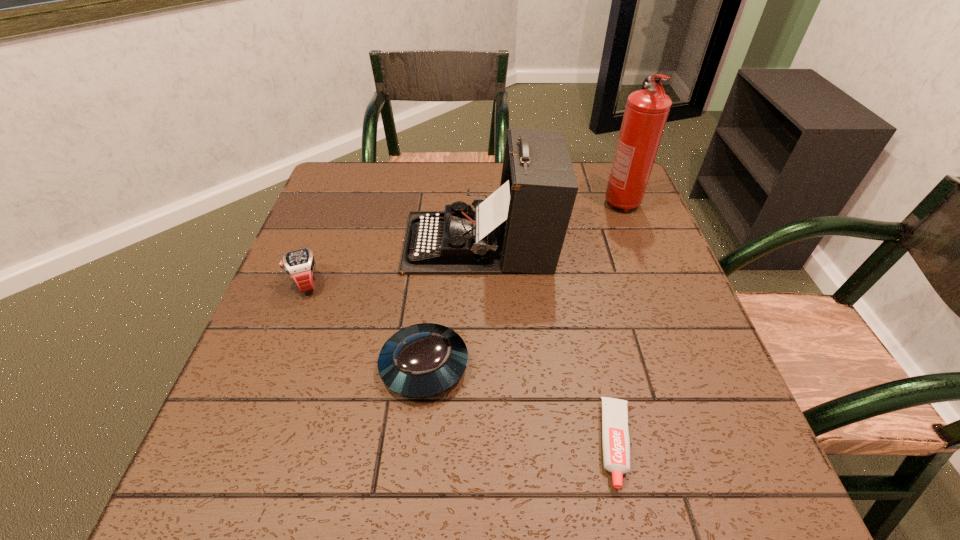
You are a GUI agent. You are given a task and a screenshot of the screen. Output one action in this format:
    pyautogui.click(x=<x>, y=<y>)
    Task: Click on the vacant space located 0.240m inside the open case of the second tallest object
    The height and width of the screenshot is (540, 960).
    Given the screenshot: What is the action you would take?
    pyautogui.click(x=308, y=242)

What are the coordinates of `free point located 0.120m inside the open case of the second tallest object` in the screenshot? It's located at 356,242.

You are a GUI agent. You are given a task and a screenshot of the screen. Output one action in this format:
    pyautogui.click(x=<x>, y=<y>)
    Task: Click on the free space located on the right of the third tallest object
    The width and height of the screenshot is (960, 540).
    Given the screenshot: What is the action you would take?
    pyautogui.click(x=483, y=282)

At what (x,y) coordinates should I click in order to perform the action: click on free region located 0.070m on the front of the second shortest object. Please return your answer as a coordinate pair (x, y). The width and height of the screenshot is (960, 540). Looking at the image, I should click on (417, 442).

The image size is (960, 540). I want to click on free location located on the back of the shortest object, so click(581, 287).

You are a GUI agent. You are given a task and a screenshot of the screen. Output one action in this format:
    pyautogui.click(x=<x>, y=<y>)
    Task: Click on the object that is at the far edge
    Image resolution: width=960 pixels, height=540 pixels.
    Given the screenshot: What is the action you would take?
    pyautogui.click(x=646, y=112)

You are a GUI agent. You are given a task and a screenshot of the screen. Output one action in this format:
    pyautogui.click(x=<x>, y=<y>)
    Task: Click on the object that is at the near edge
    Image resolution: width=960 pixels, height=540 pixels.
    Given the screenshot: What is the action you would take?
    pos(616,445)

Image resolution: width=960 pixels, height=540 pixels. In order to click on object that is positioned at the left edge in this screenshot , I will do [299, 264].

Find the location of a particular element. Image resolution: width=960 pixels, height=540 pixels. object present at the right edge is located at coordinates (646, 112).

This screenshot has width=960, height=540. In order to click on object at the far right corner in this screenshot , I will do pos(646,112).